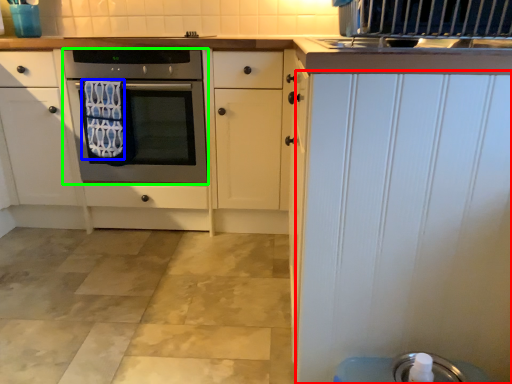
Question: Considering the real-world distances, which object is farthest from door (highlighted by a red box)? bath towel (highlighted by a blue box) or oven (highlighted by a green box)?

Choices:
 (A) bath towel
 (B) oven

Answer: (A)